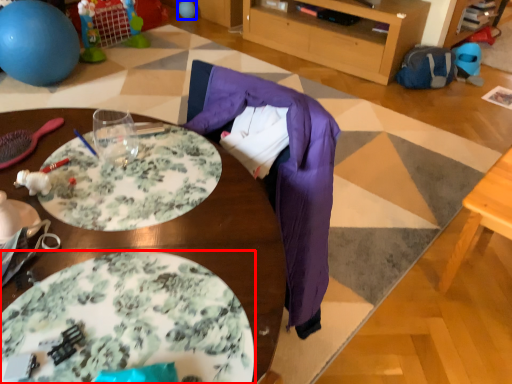
Question: Which of the following is the closest to the observer, plate (highlighted by a red box) or balloon (highlighted by a blue box)?

Choices:
 (A) plate
 (B) balloon

Answer: (A)